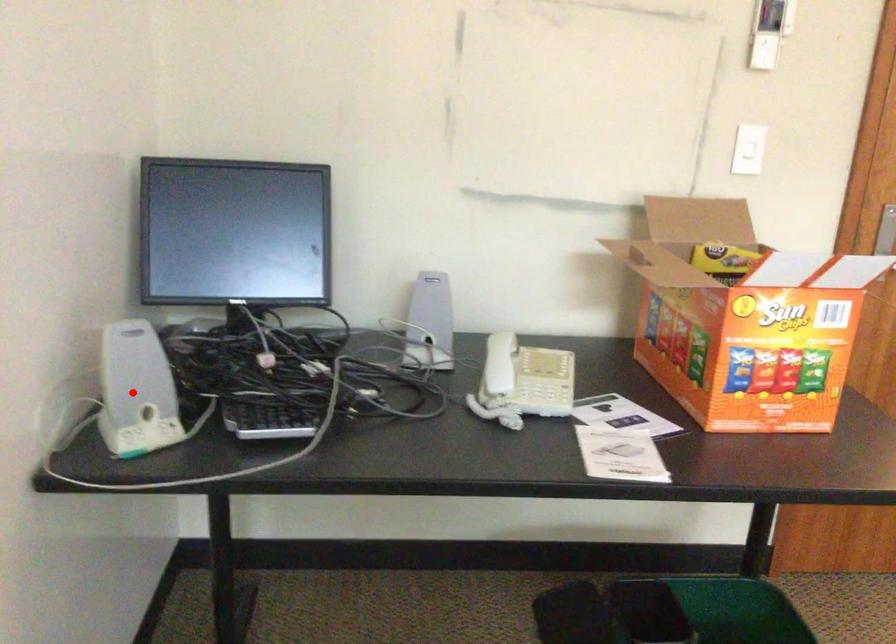
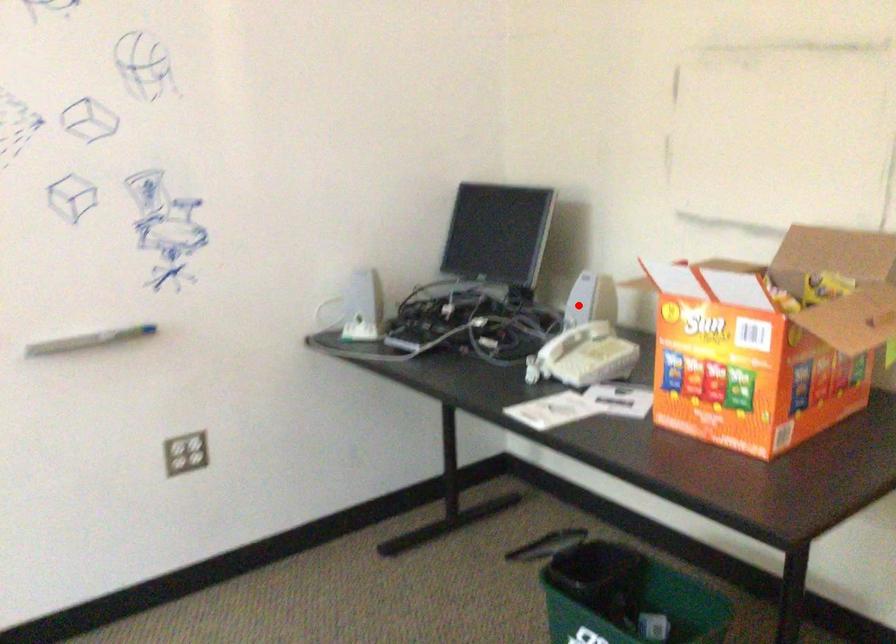
From the picture: I am providing you with two images of the same scene from different viewpoints. A red point is marked on the first image and another point is marked on the second image. Are the points marked in image1 and image2 representing the same 3D position?

No